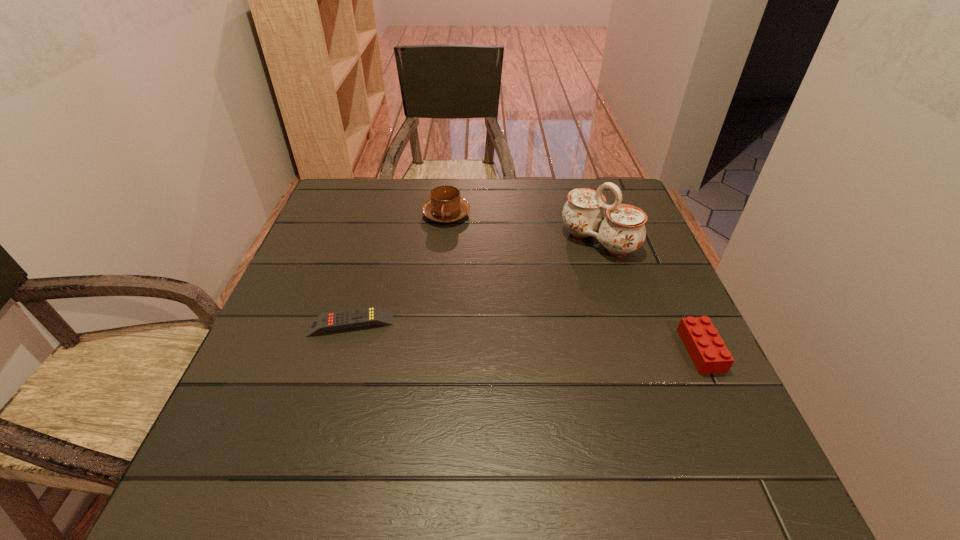
You are a GUI agent. You are given a task and a screenshot of the screen. Output one action in this format:
    pyautogui.click(x=<x>, y=<y>)
    Task: Click on the object that ranks as the second closest to the second shortest object
    This screenshot has width=960, height=540.
    Given the screenshot: What is the action you would take?
    pyautogui.click(x=445, y=206)

Identify the location of vacant space that satisfies the following two spatial constraints: 1. on the front side of the rightmost object; 2. on the right side of the shortest object. This screenshot has width=960, height=540. (343, 350).

At what (x,y) coordinates should I click in order to perform the action: click on free space that satisfies the following two spatial constraints: 1. on the front side of the second tallest object; 2. on the right side of the Lego. Please return your answer as a coordinate pair (x, y). Looking at the image, I should click on (433, 350).